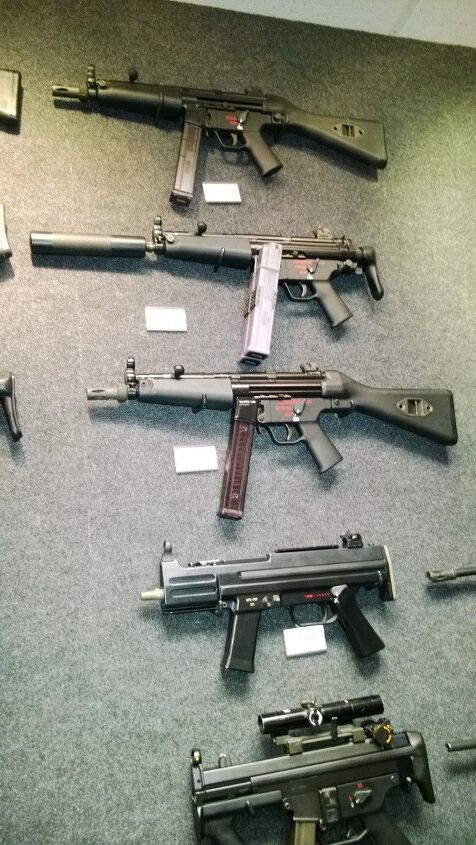
This screenshot has height=845, width=476. Identify the location of magazines. (305, 826), (238, 649), (228, 481), (258, 298), (186, 177).